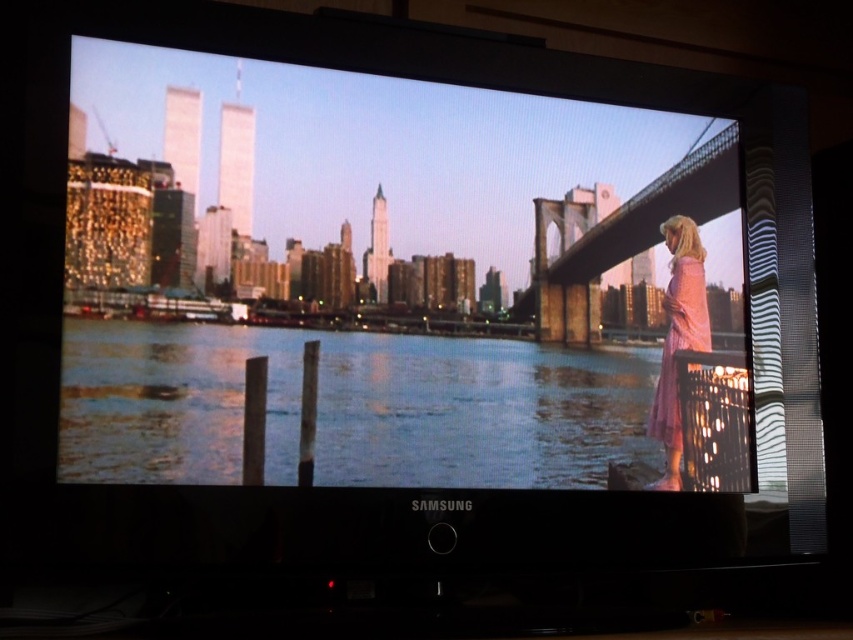
You are looking at the TV screen and want to determine which of the two points, point [569,436] or point [648,488], is closer to you. Based on the scene displayed on the screen, can you tell which one is nearer?

Point [569,436] is closer to the viewer than point [648,488].

You are a costume designer reviewing a movie scene on a Samsung TV. You notice the pink fabric woman at right and the pink satin dress at right in the scene. Which one appears larger in the image?

The pink fabric woman at right is taller than the pink satin dress at right, so the woman appears larger than the dress in the image.

You are watching a movie on a Samsung TV and notice two elements in the scene. The first is the blue reflective water at lower center and the second is the pink satin dress at right. Based on their positions, which object is closer to the bottom edge of the TV screen?

The blue reflective water at lower center is closer to the bottom edge of the TV screen because it is positioned below the pink satin dress at right.